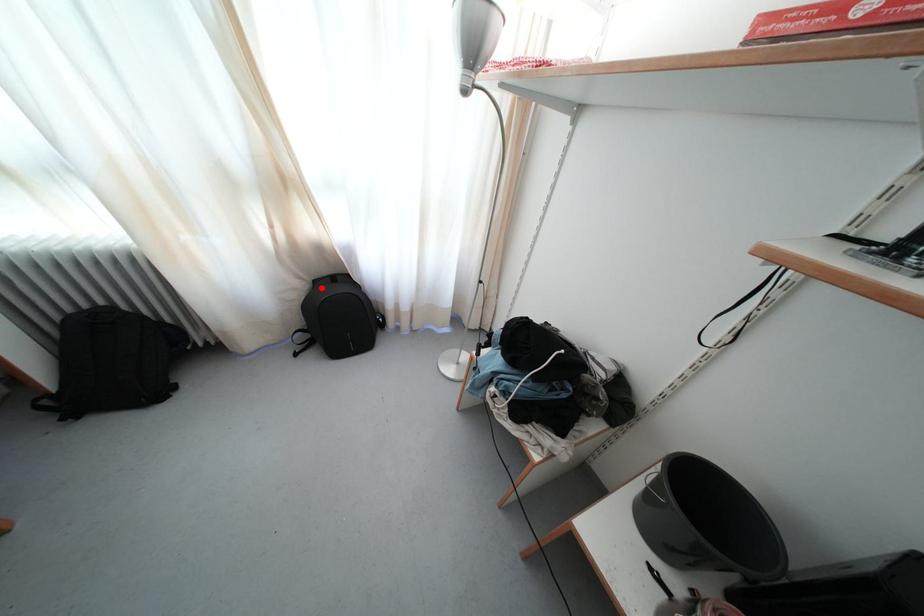
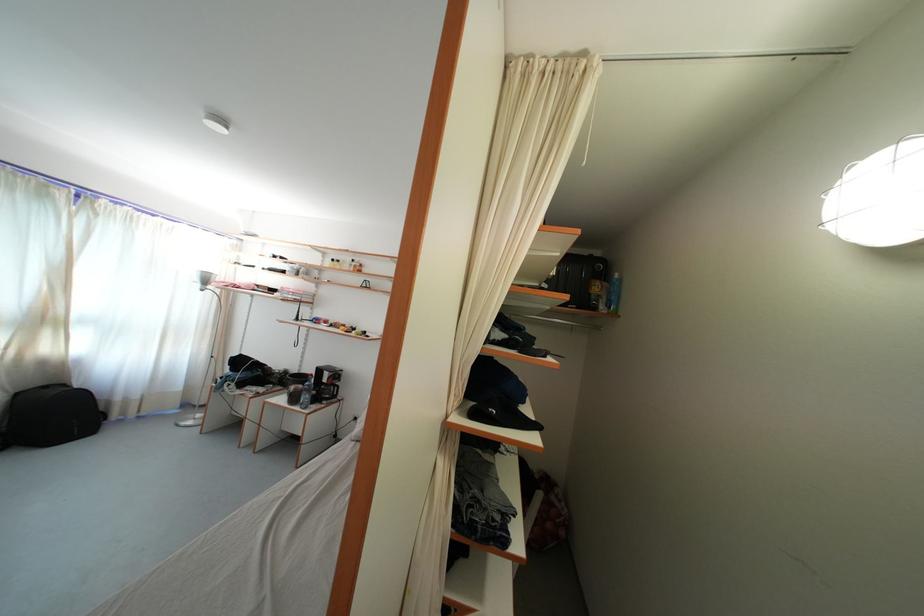
In the second image, find the point that corresponds to the highlighted location in the first image.

(23, 400)